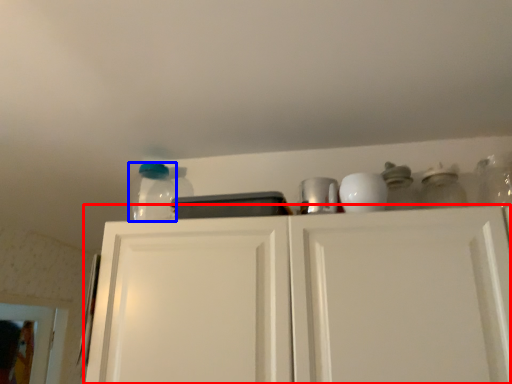
Question: Which of the following is the farthest to the observer, cabinetry (highlighted by a red box) or glass jar (highlighted by a blue box)?

Choices:
 (A) cabinetry
 (B) glass jar

Answer: (B)